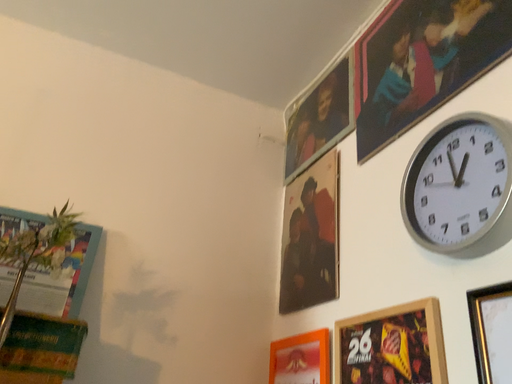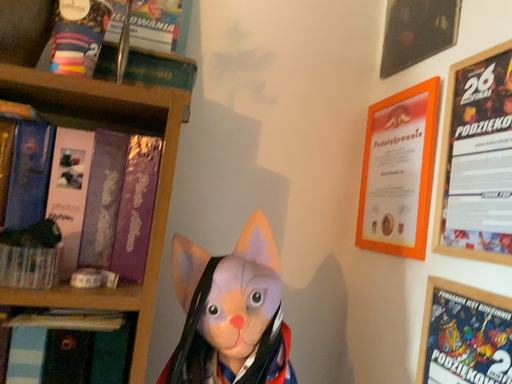
Question: How did the camera likely rotate when shooting the video?

Choices:
 (A) rotated downward
 (B) rotated upward

Answer: (A)